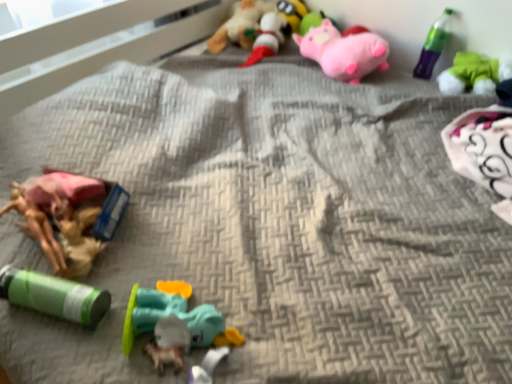
Question: Could green matte cylinder at lower left, positioned as the 5th toy in top-to-bottom order, be considered to be inside green plush toy at upper right, placed as the 4th toy when sorted from top to bottom?

Choices:
 (A) no
 (B) yes

Answer: (A)

Question: From a real-world perspective, is green plush toy at upper right, placed as the 4th toy when sorted from top to bottom, positioned over green matte cylinder at lower left, positioned as the 5th toy in top-to-bottom order, based on gravity?

Choices:
 (A) no
 (B) yes

Answer: (B)

Question: Considering the relative sizes of green plush toy at upper right, the fifth toy ordered from the bottom, and green matte cylinder at lower left, positioned as the 5th toy in top-to-bottom order, in the image provided, is green plush toy at upper right, the fifth toy ordered from the bottom, taller than green matte cylinder at lower left, positioned as the 5th toy in top-to-bottom order,?

Choices:
 (A) yes
 (B) no

Answer: (A)

Question: Does green plush toy at upper right, the fifth toy ordered from the bottom, have a larger size compared to green matte cylinder at lower left, which appears as the 4th toy when ordered from the bottom?

Choices:
 (A) yes
 (B) no

Answer: (A)

Question: Is green plush toy at upper right, the fifth toy ordered from the bottom, shorter than green matte cylinder at lower left, which appears as the 4th toy when ordered from the bottom?

Choices:
 (A) yes
 (B) no

Answer: (B)

Question: Does green plush toy at upper right, placed as the 4th toy when sorted from top to bottom, have a smaller size compared to green matte cylinder at lower left, which appears as the 4th toy when ordered from the bottom?

Choices:
 (A) no
 (B) yes

Answer: (A)

Question: Does teal rubber duck at center, arranged as the third toy when ordered from the bottom, touch pink plush pig at upper right, positioned as the 6th toy in bottom-to-top order?

Choices:
 (A) yes
 (B) no

Answer: (B)

Question: From a real-world perspective, is teal rubber duck at center, the 6th toy when ordered from top to bottom, beneath pink plush pig at upper right, positioned as the 6th toy in bottom-to-top order?

Choices:
 (A) yes
 (B) no

Answer: (A)

Question: Is teal rubber duck at center, arranged as the third toy when ordered from the bottom, oriented towards pink plush pig at upper right, positioned as the 6th toy in bottom-to-top order?

Choices:
 (A) no
 (B) yes

Answer: (A)

Question: Considering the relative sizes of teal rubber duck at center, the 6th toy when ordered from top to bottom, and pink plush pig at upper right, the 3th toy positioned from the top, in the image provided, is teal rubber duck at center, the 6th toy when ordered from top to bottom, thinner than pink plush pig at upper right, the 3th toy positioned from the top,?

Choices:
 (A) no
 (B) yes

Answer: (B)

Question: Is teal rubber duck at center, the 6th toy when ordered from top to bottom, facing away from pink plush pig at upper right, positioned as the 6th toy in bottom-to-top order?

Choices:
 (A) yes
 (B) no

Answer: (B)

Question: Considering the relative sizes of teal rubber duck at center, arranged as the third toy when ordered from the bottom, and pink plush pig at upper right, positioned as the 6th toy in bottom-to-top order, in the image provided, is teal rubber duck at center, arranged as the third toy when ordered from the bottom, smaller than pink plush pig at upper right, positioned as the 6th toy in bottom-to-top order,?

Choices:
 (A) no
 (B) yes

Answer: (B)

Question: From the image's perspective, is green plastic bottle at upper right beneath pink plush pig at upper right, the 3th toy positioned from the top?

Choices:
 (A) yes
 (B) no

Answer: (A)